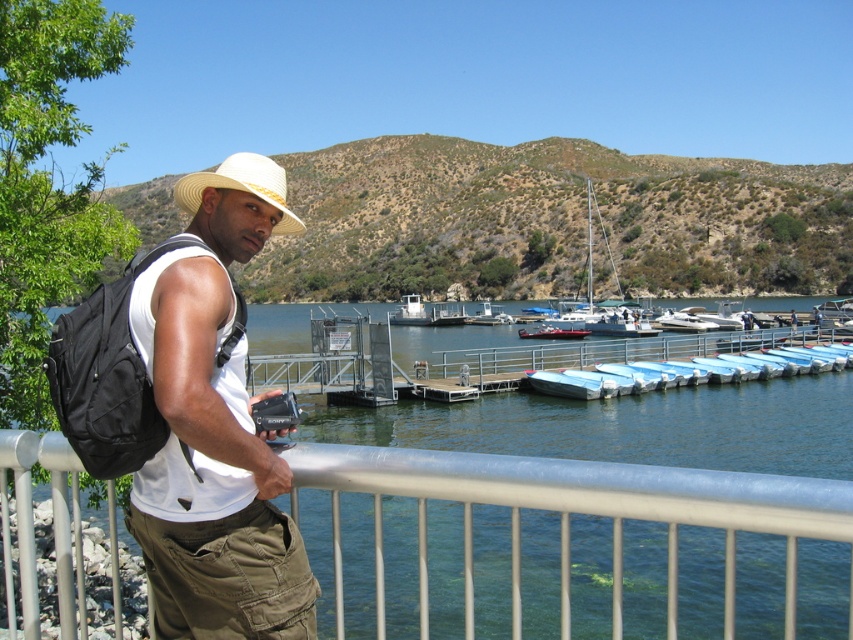
Question: Can you confirm if silver metallic fence at lower center is smaller than beige straw hat at center?

Choices:
 (A) yes
 (B) no

Answer: (A)

Question: Does khaki cotton pants at lower center have a smaller size compared to white sailboat at center?

Choices:
 (A) yes
 (B) no

Answer: (A)

Question: Estimate the real-world distances between objects in this image. Which object is closer to the khaki cotton pants at lower center?

Choices:
 (A) white matte hat at upper left
 (B) white sailboat at center
 (C) metallic silver boat at center

Answer: (A)

Question: Which of the following is the closest to the observer?

Choices:
 (A) (236, 490)
 (B) (595, 493)
 (C) (601, 310)
 (D) (265, 168)

Answer: (B)

Question: Does silver metallic fence at lower center come behind metallic silver boat at center?

Choices:
 (A) yes
 (B) no

Answer: (B)

Question: Considering the real-world distances, which object is closest to the beige straw hat at center?

Choices:
 (A) khaki cotton pants at lower center
 (B) white sailboat at center
 (C) white matte hat at upper left

Answer: (A)